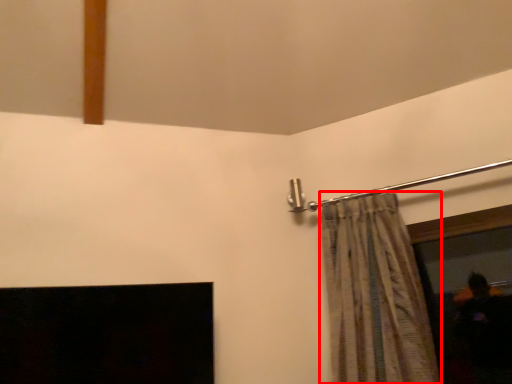
Question: From the image, what is the correct spatial relationship of curtain (annotated by the red box) in relation to window screen?

Choices:
 (A) left
 (B) right

Answer: (A)